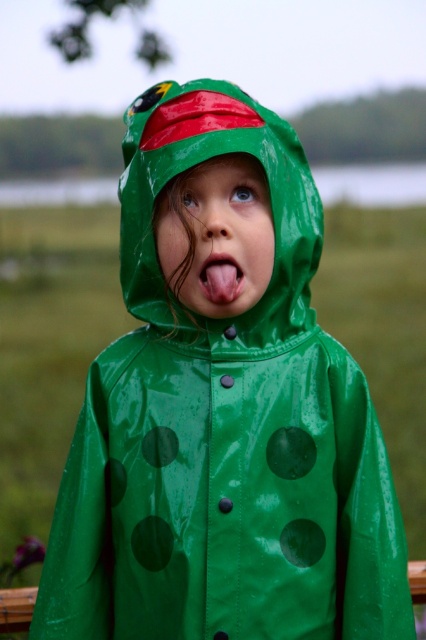
You are a photographer trying to capture the child in the rain. The green rubber raincoat at center and the pink flesh at center are both in focus. Which one is larger in the photo?

The green rubber raincoat at center is bigger than pink flesh at center, so the green rubber raincoat at center appears larger in the photo.

You are a photographer trying to capture the child in the center of the image. The camera focuses on the green rubber raincoat at center at point 0.253, 0.474. To ensure the child is centered, where should you adjust the camera focus?

The green rubber raincoat at center is already positioned at point (x=201, y=161), so the camera focus is correctly centered on the child.